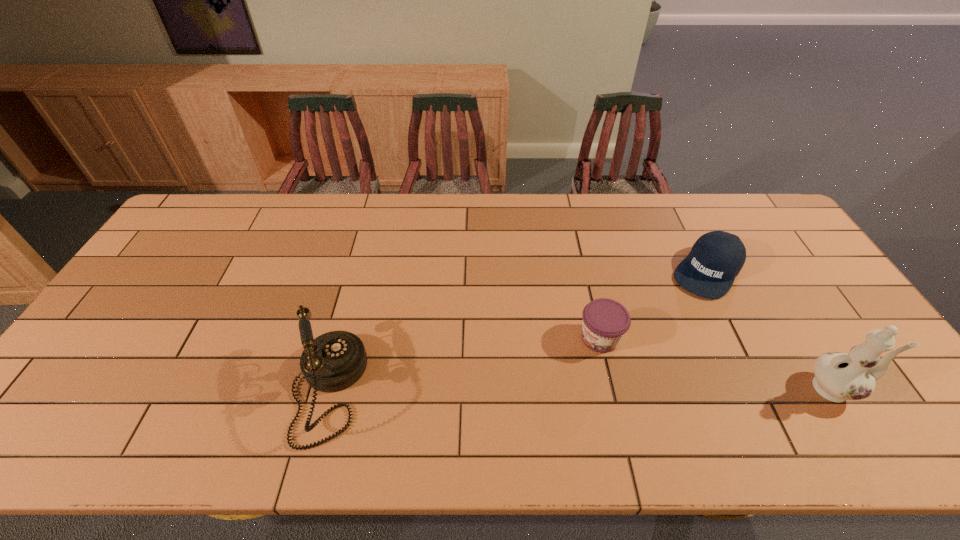
Find the location of a particular element. This screenshot has width=960, height=540. blank space at the far right corner of the desktop is located at coordinates click(x=781, y=225).

Image resolution: width=960 pixels, height=540 pixels. Find the location of `free spot between the farthest object and the third object from right to left`. free spot between the farthest object and the third object from right to left is located at coordinates (654, 305).

Where is `vacant area that lies between the second object from left to right and the baseball cap`? The image size is (960, 540). vacant area that lies between the second object from left to right and the baseball cap is located at coordinates click(654, 305).

This screenshot has height=540, width=960. Identify the location of free spot between the chinaware and the telephone. (582, 389).

Find the location of `vacant region between the baseball cap and the jam`. vacant region between the baseball cap and the jam is located at coordinates (654, 305).

Where is `vacant space in between the farthest object and the tallest object`? Image resolution: width=960 pixels, height=540 pixels. vacant space in between the farthest object and the tallest object is located at coordinates (772, 330).

At what (x,y) coordinates should I click in order to perform the action: click on empty location between the chinaware and the third object from right to left. Please return your answer as a coordinate pair (x, y). Looking at the image, I should click on (718, 363).

Find the location of `free point between the farthest object and the jam`. free point between the farthest object and the jam is located at coordinates (x=654, y=305).

Where is `free space between the chinaware and the baseball cap`? The image size is (960, 540). free space between the chinaware and the baseball cap is located at coordinates (772, 330).

Where is `unoccupied area between the chinaware and the baseball cap`? Image resolution: width=960 pixels, height=540 pixels. unoccupied area between the chinaware and the baseball cap is located at coordinates (772, 330).